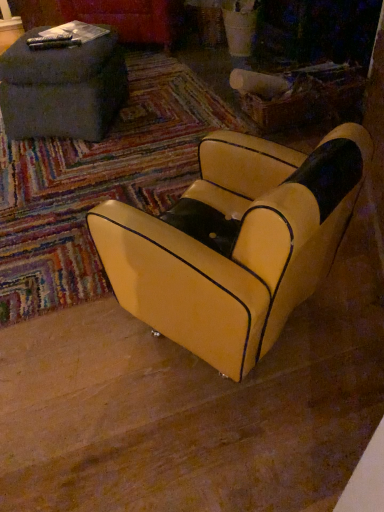
The image size is (384, 512). I want to click on vacant area in front of yellow leather chair at center, so click(x=226, y=435).